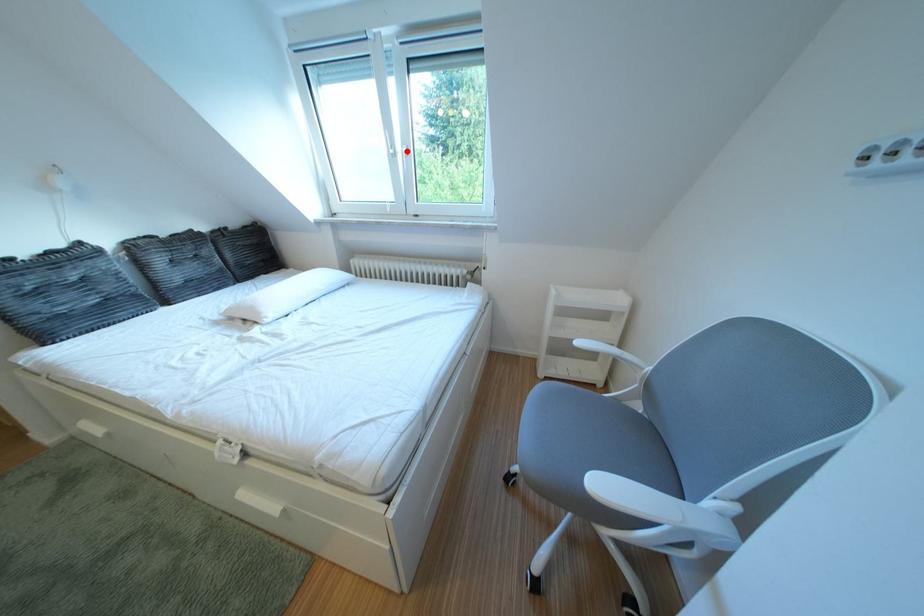
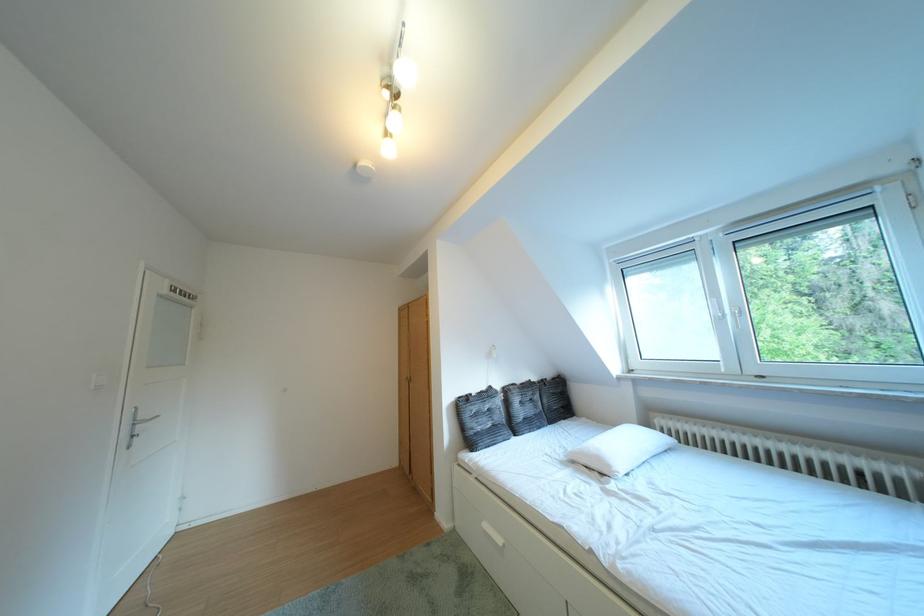
Question: I am providing you with two images of the same scene from different viewpoints. Image1 has a red point marked. In image2, the corresponding 3D location appears at what relative position? Reply with the corresponding letter.

Choices:
 (A) Closer
 (B) Farther

Answer: (B)